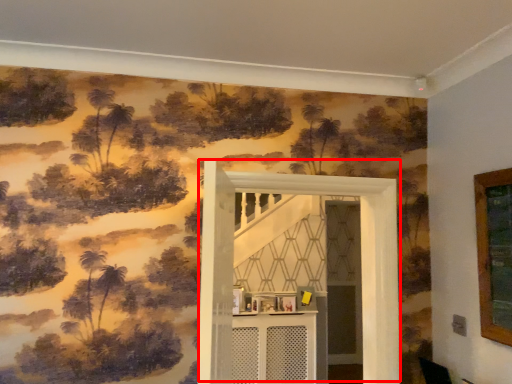
Question: From the image's perspective, what is the correct spatial relationship of door (annotated by the red box) in relation to table?

Choices:
 (A) above
 (B) below

Answer: (A)